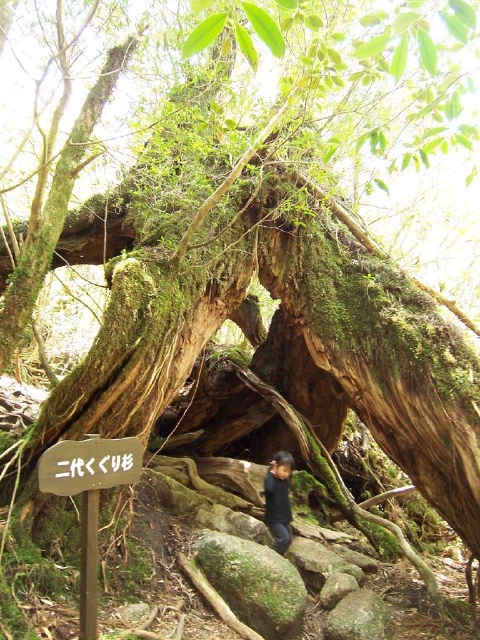
You are a hiker who wants to place a small marker between the green mossy rock at lower center and the wooden sign at center. If the marker is 2 feet long, will it fit between them?

The distance between the green mossy rock at lower center and the wooden sign at center is 6.08 feet. Since the marker is only 2 feet long, there is enough space to place it between them.

From the picture: You are a hiker who wants to place a small backpack between the green mossy rock at lower center and the wooden sign at center. Which object should you place the backpack closer to if you want it to be near the larger object?

The green mossy rock at lower center is larger than the wooden sign at center, so you should place the backpack closer to the green mossy rock at lower center.